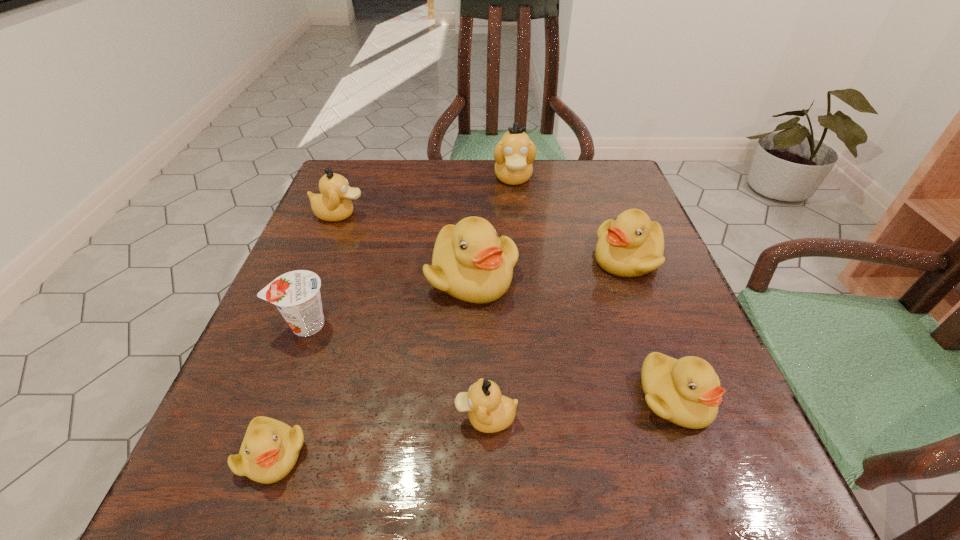
Where is `free space between the third biggest yellow duckling and the biggest yellow duckling`? The height and width of the screenshot is (540, 960). free space between the third biggest yellow duckling and the biggest yellow duckling is located at coordinates (574, 337).

Where is `free space between the yogurt and the smallest yellow duckling`? The height and width of the screenshot is (540, 960). free space between the yogurt and the smallest yellow duckling is located at coordinates (289, 389).

The height and width of the screenshot is (540, 960). What are the coordinates of `vacant region between the smallest yellow duckling and the yogurt` in the screenshot? It's located at (289, 389).

At what (x,y) coordinates should I click in order to perform the action: click on the third closest object relative to the second biggest yellow duckling. Please return your answer as a coordinate pair (x, y). Image resolution: width=960 pixels, height=540 pixels. Looking at the image, I should click on (686, 392).

Select which object is the closest to the yogurt. Please provide its 2D coordinates. Your answer should be formatted as a tuple, i.e. [(x, y)], where the tuple contains the x and y coordinates of a point satisfying the conditions above.

[(270, 449)]

Find the location of a particular element. duckling that is the sixth nearest to the second biggest yellow duckling is located at coordinates (270, 449).

I want to click on the fourth closest duckling to the second biggest yellow duckling, so click(x=489, y=412).

Locate which tan duckling ranks second in proximity to the second smallest yellow duckling. Please provide its 2D coordinates. Your answer should be formatted as a tuple, i.e. [(x, y)], where the tuple contains the x and y coordinates of a point satisfying the conditions above.

[(514, 154)]

This screenshot has width=960, height=540. What are the coordinates of `tan duckling that is the third closest to the second smallest yellow duckling` in the screenshot? It's located at (333, 204).

Locate which yellow duckling is the third closest to the third biggest yellow duckling. Please provide its 2D coordinates. Your answer should be formatted as a tuple, i.e. [(x, y)], where the tuple contains the x and y coordinates of a point satisfying the conditions above.

[(270, 449)]